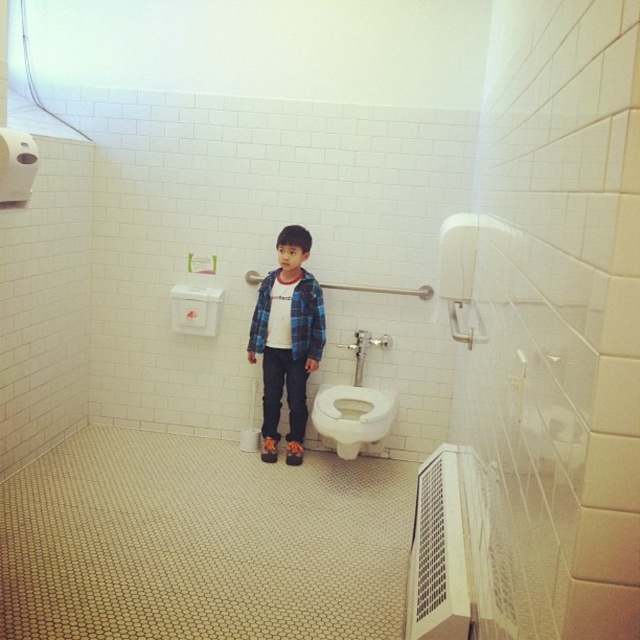
Question: Estimate the real-world distances between objects in this image. Which object is closer to the white matte toilet paper at upper left?

Choices:
 (A) matte plaid shirt at center
 (B) white glossy toilet at lower center

Answer: (A)

Question: Is white glossy toilet at lower center positioned behind white matte toilet paper at upper left?

Choices:
 (A) yes
 (B) no

Answer: (A)

Question: Which point is farther to the camera?

Choices:
 (A) white glossy toilet at lower center
 (B) matte plaid shirt at center

Answer: (B)

Question: Where is matte plaid shirt at center located in relation to white glossy toilet at lower center in the image?

Choices:
 (A) right
 (B) left

Answer: (B)

Question: Which of these objects is positioned closest to the white glossy toilet at lower center?

Choices:
 (A) matte plaid shirt at center
 (B) white matte toilet paper at upper left

Answer: (A)

Question: Can you confirm if matte plaid shirt at center is positioned to the left of white matte toilet paper at upper left?

Choices:
 (A) no
 (B) yes

Answer: (A)